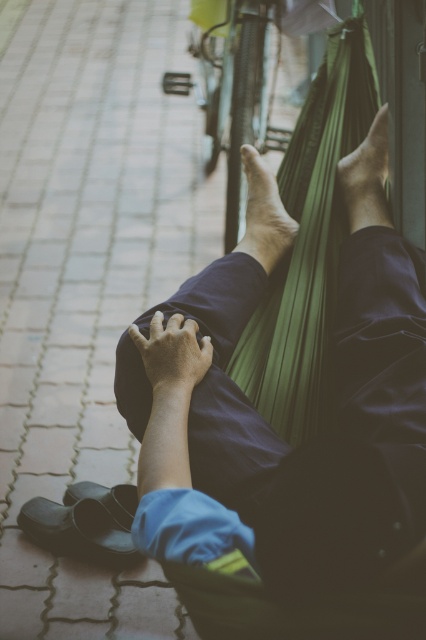
You are a photographer trying to capture the green fabric hammock at upper center and the black leather sandal at lower left in a single frame. Given that the camera can only focus on objects within a 100cm width, will both objects fit in the frame if the hammock is wider than the sandal?

The green fabric hammock at upper center is bigger than the black leather sandal at lower left. Since the hammock is wider than the sandal, the total width required to include both would depend on their combined size. However, the camera can only focus on objects within a 100cm width. Without knowing the exact dimensions of each object, it is impossible to determine if they will both fit in the frame.

From the picture: You are a photographer taking a picture of the smooth skin foot at center and the smooth skin foot at upper center. Which foot appears closer to the camera in the photo?

The smooth skin foot at center appears closer to the camera because it is further to the viewer than the smooth skin foot at upper center.